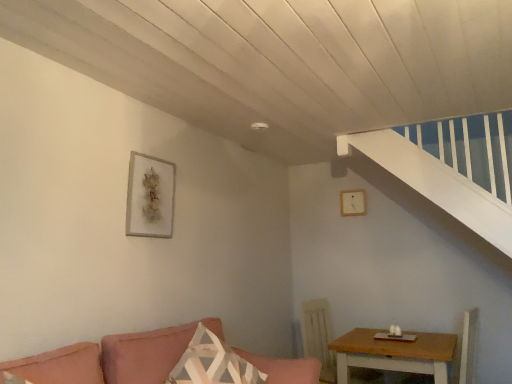
Question: Is matte gray picture frame at upper left, marked as the first picture frame in a left-to-right arrangement, far away from pink fabric couch at lower left?

Choices:
 (A) no
 (B) yes

Answer: (A)

Question: Is matte gray picture frame at upper left, marked as the 2th picture frame in a back-to-front arrangement, at the left side of pink fabric couch at lower left?

Choices:
 (A) yes
 (B) no

Answer: (A)

Question: Does matte gray picture frame at upper left, the first picture frame in the front-to-back sequence, have a larger size compared to pink fabric couch at lower left?

Choices:
 (A) no
 (B) yes

Answer: (A)

Question: From a real-world perspective, is matte gray picture frame at upper left, the first picture frame in the front-to-back sequence, on top of pink fabric couch at lower left?

Choices:
 (A) no
 (B) yes

Answer: (B)

Question: Are matte gray picture frame at upper left, the first picture frame in the front-to-back sequence, and pink fabric couch at lower left making contact?

Choices:
 (A) yes
 (B) no

Answer: (B)

Question: Is matte gray picture frame at upper left, marked as the second picture frame in a right-to-left arrangement, smaller than pink fabric couch at lower left?

Choices:
 (A) no
 (B) yes

Answer: (B)

Question: Is matte gray picture frame at upper left, marked as the 2th picture frame in a back-to-front arrangement, in front of matte white picture frame at upper center, placed as the first picture frame when sorted from right to left?

Choices:
 (A) yes
 (B) no

Answer: (A)

Question: From a real-world perspective, is matte gray picture frame at upper left, marked as the second picture frame in a right-to-left arrangement, on matte white picture frame at upper center, placed as the first picture frame when sorted from right to left?

Choices:
 (A) yes
 (B) no

Answer: (B)

Question: Does matte gray picture frame at upper left, marked as the 2th picture frame in a back-to-front arrangement, turn towards matte white picture frame at upper center, which is the 2th picture frame in left-to-right order?

Choices:
 (A) no
 (B) yes

Answer: (A)

Question: Is matte gray picture frame at upper left, the first picture frame in the front-to-back sequence, thinner than matte white picture frame at upper center, which is the 2th picture frame in left-to-right order?

Choices:
 (A) no
 (B) yes

Answer: (A)

Question: Is matte gray picture frame at upper left, the first picture frame in the front-to-back sequence, at the right side of matte white picture frame at upper center, placed as the first picture frame when sorted from right to left?

Choices:
 (A) no
 (B) yes

Answer: (A)

Question: From the image's perspective, does matte gray picture frame at upper left, marked as the first picture frame in a left-to-right arrangement, appear higher than matte white picture frame at upper center, which is the 2th picture frame in left-to-right order?

Choices:
 (A) yes
 (B) no

Answer: (A)

Question: Does matte gray picture frame at upper left, marked as the 2th picture frame in a back-to-front arrangement, touch light brown wooden table at lower right?

Choices:
 (A) yes
 (B) no

Answer: (B)